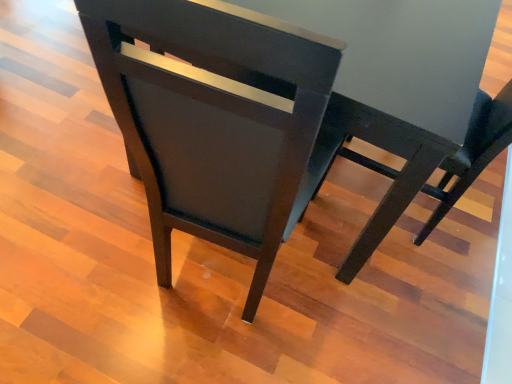
Describe the element at coordinates (215, 120) in the screenshot. I see `matte dark wood chair at center` at that location.

At what (x,y) coordinates should I click in order to perform the action: click on matte dark wood chair at center. Please return your answer as a coordinate pair (x, y). The height and width of the screenshot is (384, 512). Looking at the image, I should click on (215, 120).

The image size is (512, 384). What do you see at coordinates (398, 85) in the screenshot?
I see `matte black table at center` at bounding box center [398, 85].

Where is `matte black table at center`? This screenshot has height=384, width=512. matte black table at center is located at coordinates (398, 85).

Find the location of a particular element. This screenshot has width=512, height=384. matte dark wood chair at center is located at coordinates (215, 120).

Based on their positions, is matte black table at center located to the left or right of matte dark wood chair at center?

matte black table at center is to the right of matte dark wood chair at center.

Which object is further away from the camera, matte black table at center or matte dark wood chair at center?

matte black table at center is behind.

Is point (423, 70) positioned behind point (242, 53)?

Yes, point (423, 70) is behind point (242, 53).

From the image's perspective, is matte black table at center located above or below matte dark wood chair at center?

Based on their image positions, matte black table at center is located above matte dark wood chair at center.

From a real-world perspective, which object rests below the other?

From a 3D spatial view, matte black table at center is below.

Does matte black table at center have a lesser width compared to matte dark wood chair at center?

No, matte black table at center is not thinner than matte dark wood chair at center.

Who is shorter, matte black table at center or matte dark wood chair at center?

Standing shorter between the two is matte black table at center.

Considering the relative sizes of matte black table at center and matte dark wood chair at center in the image provided, is matte black table at center smaller than matte dark wood chair at center?

No, matte black table at center is not smaller than matte dark wood chair at center.

Could matte dark wood chair at center be considered to be inside matte black table at center?

No, matte dark wood chair at center is not inside matte black table at center.

Is matte black table at center placed right next to matte dark wood chair at center?

No, matte black table at center is not beside matte dark wood chair at center.

Is matte black table at center oriented away from matte dark wood chair at center?

No.

At what (x,y) coordinates should I click in order to perform the action: click on chair on the left of matte black table at center. Please return your answer as a coordinate pair (x, y). Looking at the image, I should click on (215, 120).

Is matte dark wood chair at center at the right side of matte black table at center?

In fact, matte dark wood chair at center is to the left of matte black table at center.

Is matte dark wood chair at center further to camera compared to matte black table at center?

No.

Considering the positions of points (127, 16) and (239, 0), is point (127, 16) closer to camera compared to point (239, 0)?

Yes, it is in front of point (239, 0).

From the image's perspective, is matte dark wood chair at center located above or below matte black table at center?

matte dark wood chair at center is below matte black table at center.

From a real-world perspective, who is located higher, matte dark wood chair at center or matte black table at center?

From a 3D spatial view, matte dark wood chair at center is above.

Is matte dark wood chair at center thinner than matte black table at center?

Indeed, matte dark wood chair at center has a lesser width compared to matte black table at center.

Is matte dark wood chair at center shorter than matte black table at center?

No.

In the scene shown: Considering the sizes of objects matte dark wood chair at center and matte black table at center in the image provided, who is smaller, matte dark wood chair at center or matte black table at center?

With smaller size is matte dark wood chair at center.

Would you say matte dark wood chair at center is inside or outside matte black table at center?

matte dark wood chair at center is outside matte black table at center.

Is matte dark wood chair at center placed right next to matte black table at center?

No, matte dark wood chair at center is not beside matte black table at center.

Is matte dark wood chair at center looking in the opposite direction of matte black table at center?

No, matte black table at center is not at the back of matte dark wood chair at center.

This screenshot has width=512, height=384. Find the location of `chair in front of the matte black table at center`. chair in front of the matte black table at center is located at coordinates (215, 120).

Image resolution: width=512 pixels, height=384 pixels. Identify the location of chair lying below the matte black table at center (from the image's perspective). (215, 120).

Locate an element on the screen. chair above the matte black table at center (from a real-world perspective) is located at coordinates (215, 120).